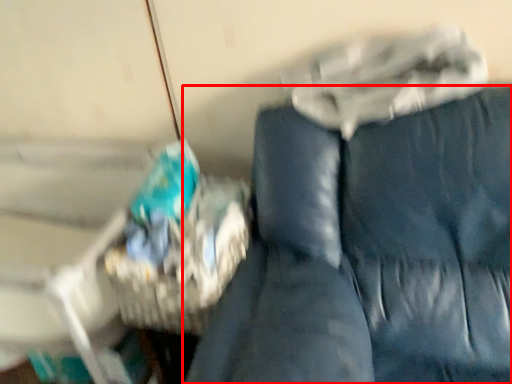
Question: Considering the relative positions of furniture (annotated by the red box) and basket in the image provided, where is furniture (annotated by the red box) located with respect to the staircase?

Choices:
 (A) left
 (B) right

Answer: (B)